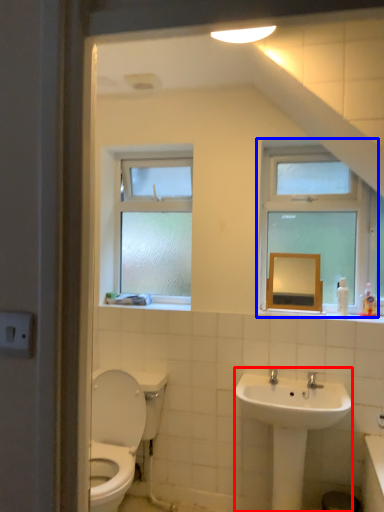
Question: Which point is further to the camera, sink (highlighted by a red box) or window (highlighted by a blue box)?

Choices:
 (A) sink
 (B) window

Answer: (B)